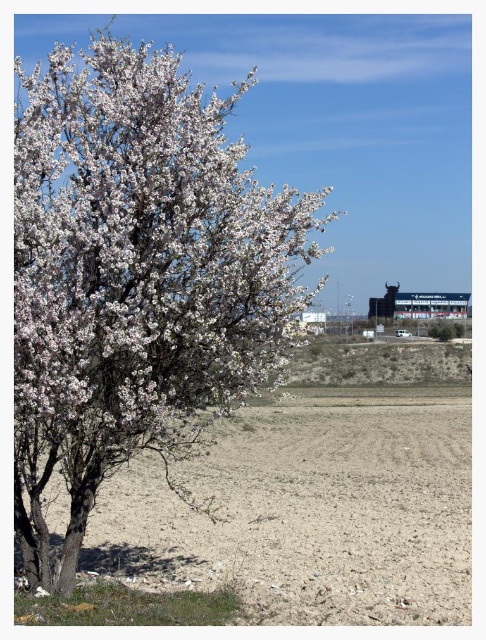
You are a farmer standing in the field and see the white matte tree at left and the dull brown soil at lower left. Which object is positioned further to the east?

The white matte tree at left is to the left of dull brown soil at lower left, so the tree is positioned further to the east.